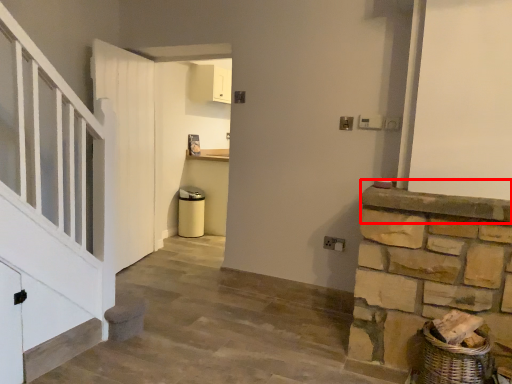
Question: In this image, where is mantle (annotated by the red box) located relative to door?

Choices:
 (A) left
 (B) right

Answer: (B)